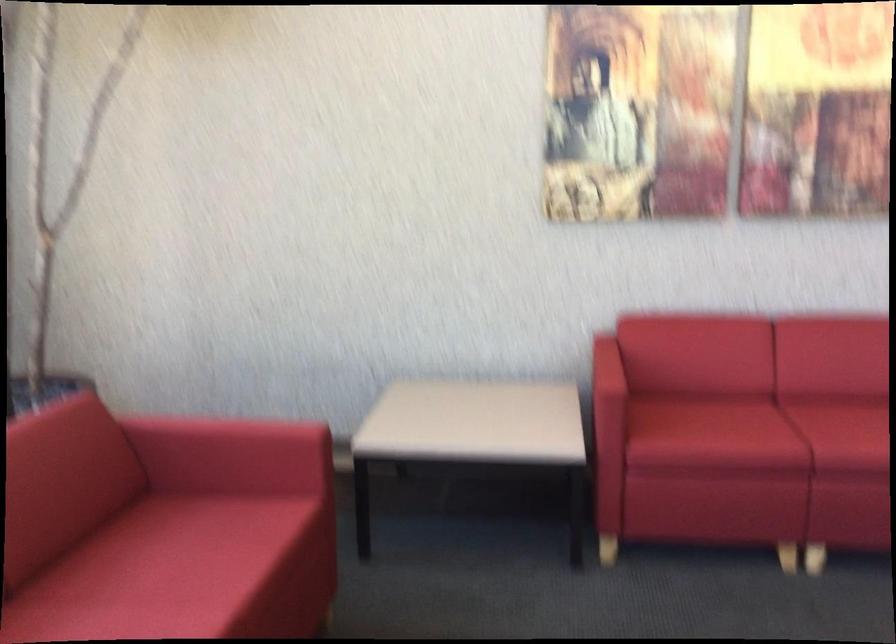
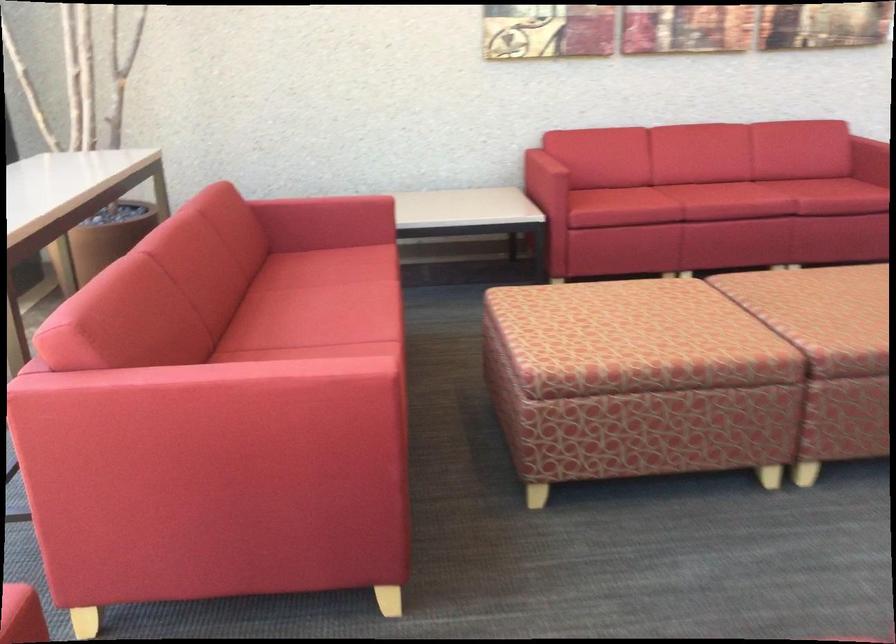
What movement of the cameraman would produce the second image?

The movement direction of the cameraman is left, backward.